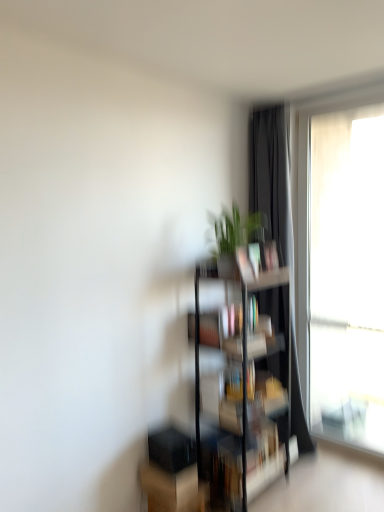
The width and height of the screenshot is (384, 512). In order to click on unoccupied region to the right of clear glass bookshelf at center in this screenshot , I will do `click(314, 495)`.